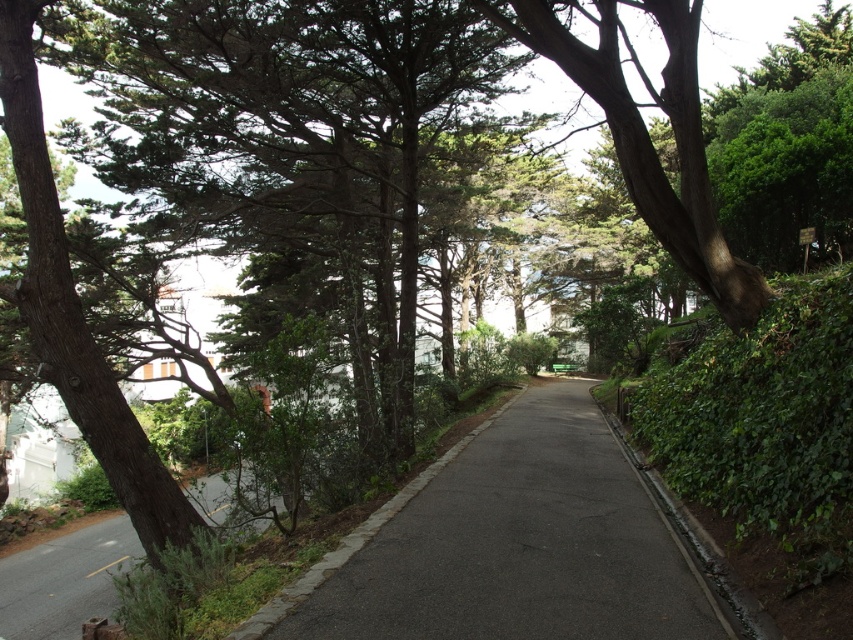
Can you confirm if dark asphalt path at center is positioned to the right of smooth brown tree trunk at center?

No, dark asphalt path at center is not to the right of smooth brown tree trunk at center.

Can you confirm if dark asphalt path at center is taller than smooth brown tree trunk at center?

In fact, dark asphalt path at center may be shorter than smooth brown tree trunk at center.

Is point (445, 572) in front of point (677, 260)?

Yes, it is.

Locate an element on the screen. This screenshot has width=853, height=640. dark asphalt path at center is located at coordinates (509, 545).

Who is more distant from viewer, (741, 292) or (96, 572)?

The point (96, 572) is behind.

Can you confirm if smooth brown tree trunk at center is shorter than smooth asphalt road at center?

In fact, smooth brown tree trunk at center may be taller than smooth asphalt road at center.

What do you see at coordinates (648, 134) in the screenshot? Image resolution: width=853 pixels, height=640 pixels. I see `smooth brown tree trunk at center` at bounding box center [648, 134].

Where is `smooth brown tree trunk at center`? Image resolution: width=853 pixels, height=640 pixels. smooth brown tree trunk at center is located at coordinates (648, 134).

Is dark asphalt path at center positioned behind smooth asphalt road at center?

No.

Is point (631, 620) behind point (114, 561)?

No, (631, 620) is in front of (114, 561).

At what (x,y) coordinates should I click in order to perform the action: click on dark asphalt path at center. Please return your answer as a coordinate pair (x, y). The height and width of the screenshot is (640, 853). Looking at the image, I should click on (509, 545).